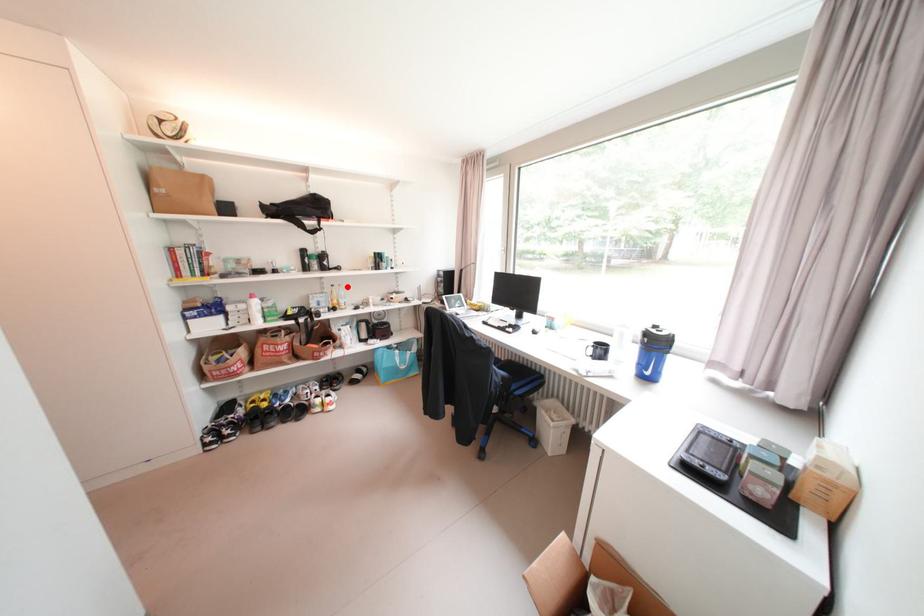
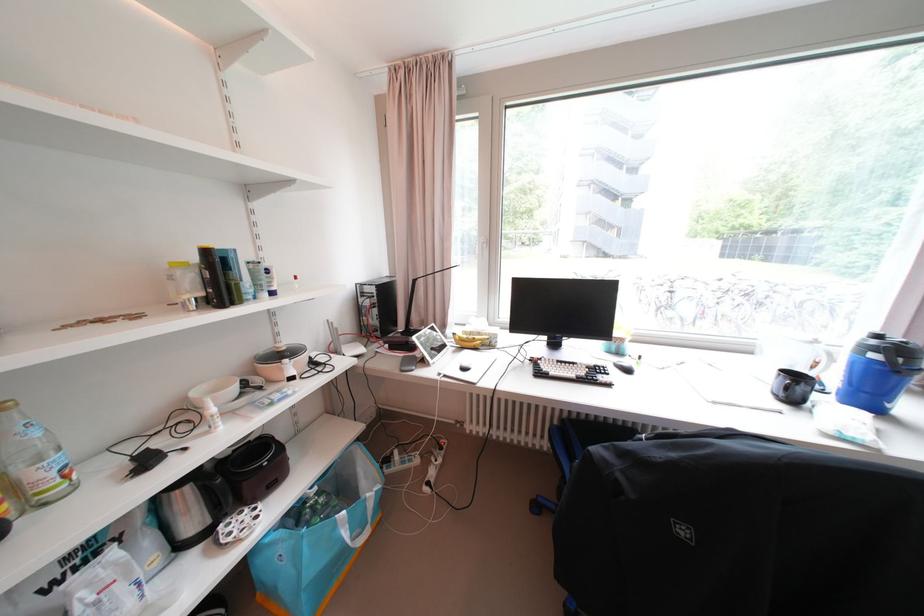
Find the pixel in the second image that matches the highlighted location in the first image.

(6, 410)